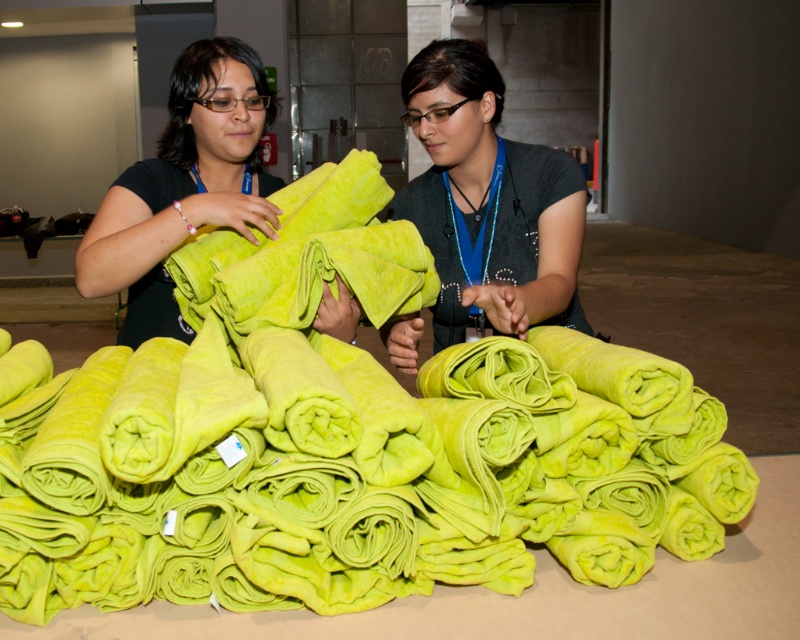
You are a worker in a warehouse and you see the lime green fleece blanket at center and the matte green towel at center. Which item is placed below the other?

The lime green fleece blanket at center is positioned under the matte green towel at center, so the blanket is below the towel.

You are a delivery person who needs to place a package between the lime green fleece blanket at center and the matte green towel at center. The package is 14 inches long. Can you fit it between them without overlapping either item?

The distance between the lime green fleece blanket at center and the matte green towel at center is 13.63 inches. Since the package is 14 inches long, it cannot fit between them without overlapping either item.